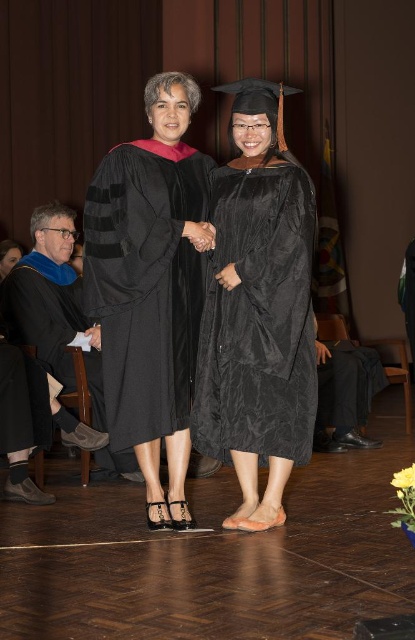
You are attending a graduation ceremony and see two individuals dressed in academic attire. The person on the right is wearing a matte black graduation gown at center, and the person on the left is wearing a matte black robe at left. Which individual is positioned closer to the right side of the scene?

The matte black graduation gown at center is positioned to the right of the matte black robe at left, so the individual wearing the matte black graduation gown at center is closer to the right side of the scene.

You are a photographer at the graduation ceremony. You need to position yourself so that you can capture both the matte black gown at center and the matte black robe at left in the same frame. Which direction should you move relative to the current position to ensure both are visible?

You should move to the left so that both the matte black gown at center and the matte black robe at left are visible in the frame since the matte black gown at center is to the right of the matte black robe at left.